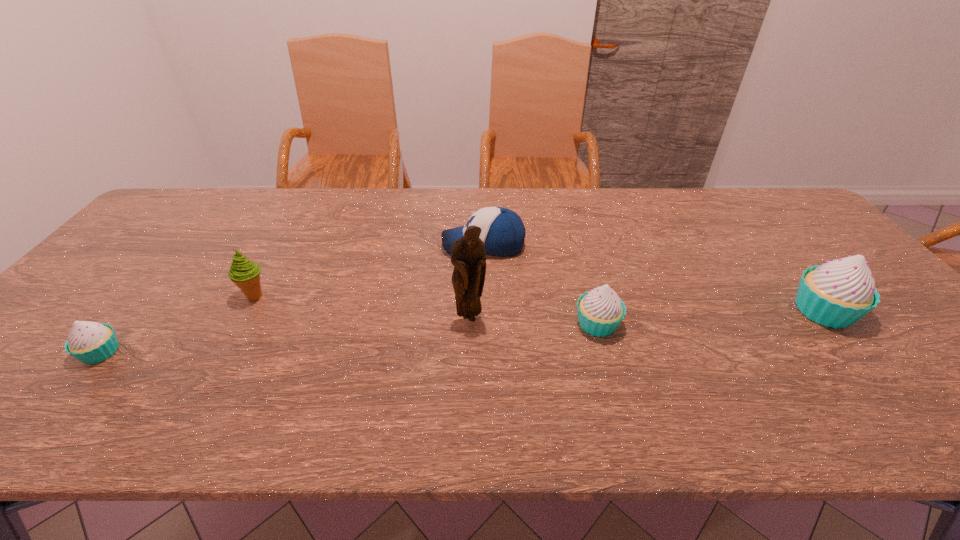
Identify the location of the shortest object. (90, 342).

Identify the location of the leftmost object. (90, 342).

I want to click on the second cupcake from left to right, so click(x=600, y=311).

You are a GUI agent. You are given a task and a screenshot of the screen. Output one action in this format:
    pyautogui.click(x=<x>, y=<y>)
    Task: Click on the second shortest cupcake
    Image resolution: width=960 pixels, height=540 pixels.
    Given the screenshot: What is the action you would take?
    pyautogui.click(x=600, y=311)

The width and height of the screenshot is (960, 540). What are the coordinates of `the tallest cupcake` in the screenshot? It's located at (837, 294).

What are the coordinates of `the rightmost cupcake` in the screenshot? It's located at (837, 294).

You are a GUI agent. You are given a task and a screenshot of the screen. Output one action in this format:
    pyautogui.click(x=<x>, y=<y>)
    Task: Click on the fifth object from right to left
    This screenshot has height=540, width=960.
    Given the screenshot: What is the action you would take?
    pyautogui.click(x=244, y=273)

Image resolution: width=960 pixels, height=540 pixels. What are the coordinates of `baseball cap` in the screenshot? It's located at (502, 231).

You are a GUI agent. You are given a task and a screenshot of the screen. Output one action in this format:
    pyautogui.click(x=<x>, y=<y>)
    Task: Click on the figurine
    The width and height of the screenshot is (960, 540).
    Given the screenshot: What is the action you would take?
    pyautogui.click(x=468, y=252)

Where is `vacant space located on the back of the shortest object`? vacant space located on the back of the shortest object is located at coordinates (167, 272).